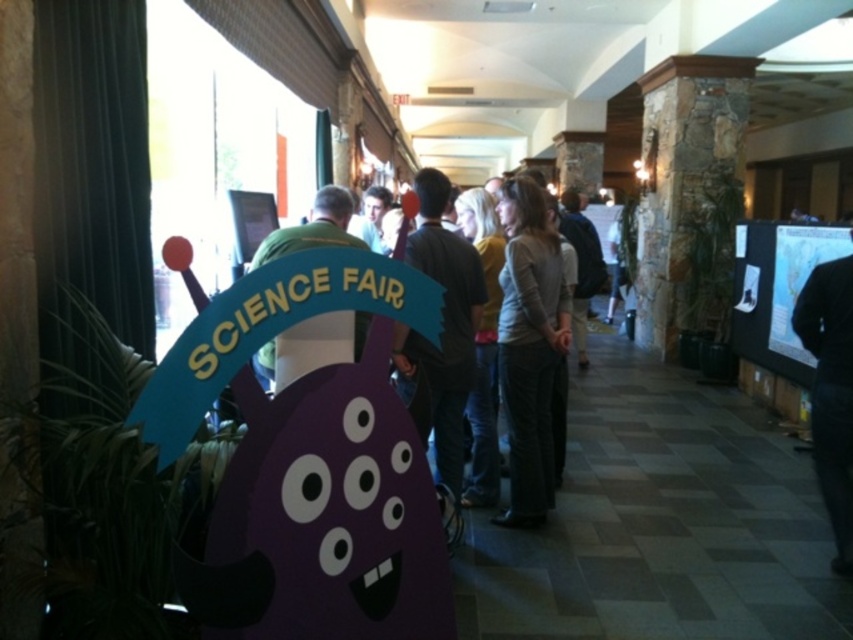
Question: Which point appears farthest from the camera in this image?

Choices:
 (A) (293, 250)
 (B) (653, 129)
 (C) (466, 385)
 (D) (459, 276)

Answer: (B)

Question: Can you confirm if stone at right is positioned to the right of gray cotton sweater at center?

Choices:
 (A) yes
 (B) no

Answer: (A)

Question: Where is gray cotton sweater at center located in relation to matte green shirt at center in the image?

Choices:
 (A) above
 (B) below

Answer: (B)

Question: Which of the following is the farthest from the observer?

Choices:
 (A) (554, 230)
 (B) (421, 374)
 (C) (444, 339)

Answer: (A)

Question: Is stone at right positioned in front of matte green shirt at center?

Choices:
 (A) yes
 (B) no

Answer: (B)

Question: Which object is farther from the camera taking this photo?

Choices:
 (A) black fabric at right
 (B) green matte shirt at center

Answer: (A)